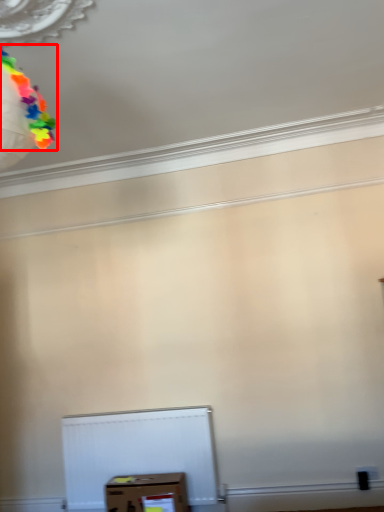
Question: Where is balloon (annotated by the red box) located in relation to box in the image?

Choices:
 (A) left
 (B) right

Answer: (A)